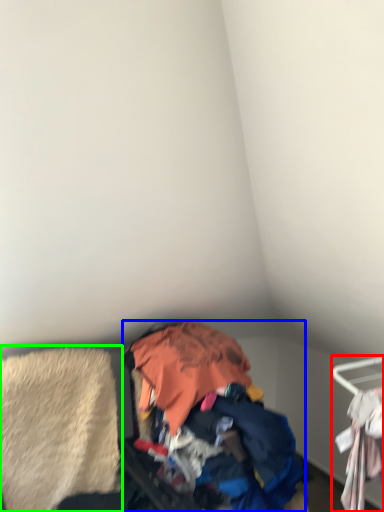
Question: Considering the real-world distances, which object is farthest from furniture (highlighted by a red box)? garbage (highlighted by a blue box) or clothing (highlighted by a green box)?

Choices:
 (A) garbage
 (B) clothing

Answer: (B)